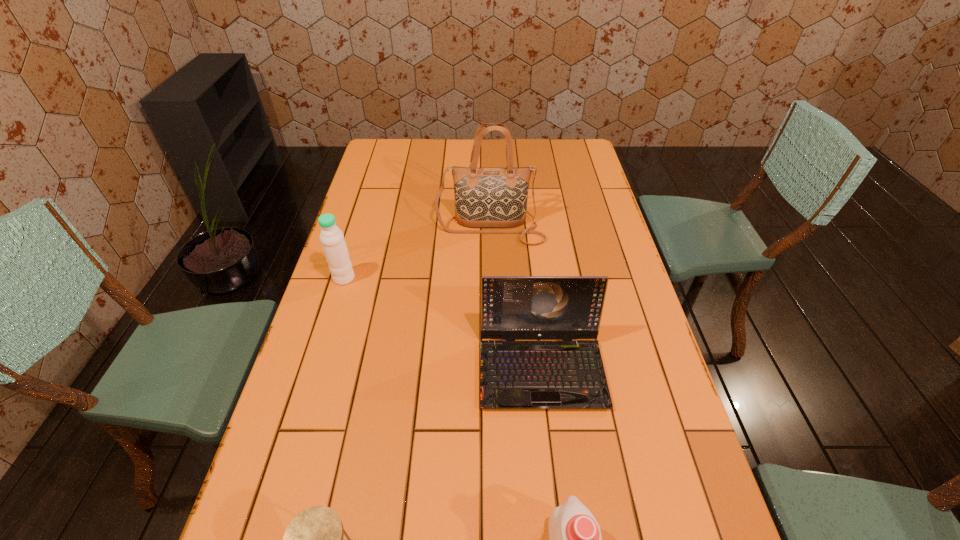
Image resolution: width=960 pixels, height=540 pixels. What are the coordinates of `the farthest object` in the screenshot? It's located at (484, 197).

Find the location of a particular element. This screenshot has width=960, height=540. handbag is located at coordinates (484, 197).

Identify the location of water bottle. Image resolution: width=960 pixels, height=540 pixels. (334, 246).

This screenshot has height=540, width=960. What are the coordinates of `the leftmost object` in the screenshot? It's located at (334, 246).

Find the location of a particular element. This screenshot has width=960, height=540. laptop computer is located at coordinates (566, 374).

You are a GUI agent. You are given a task and a screenshot of the screen. Output one action in this format:
    pyautogui.click(x=<x>, y=<y>)
    Task: Click on the free space located on the front-facing side of the handbag
    
    Given the screenshot: What is the action you would take?
    pyautogui.click(x=492, y=330)

Locate an element on the screen. The height and width of the screenshot is (540, 960). free space located 0.130m on the right of the leftmost object is located at coordinates (397, 278).

Image resolution: width=960 pixels, height=540 pixels. I want to click on free space located 0.120m on the screen of the laptop computer, so click(552, 463).

Find the location of `object at the left edge`. object at the left edge is located at coordinates (334, 246).

Find the location of a particular element. This screenshot has width=960, height=540. object situated at the right edge is located at coordinates (566, 374).